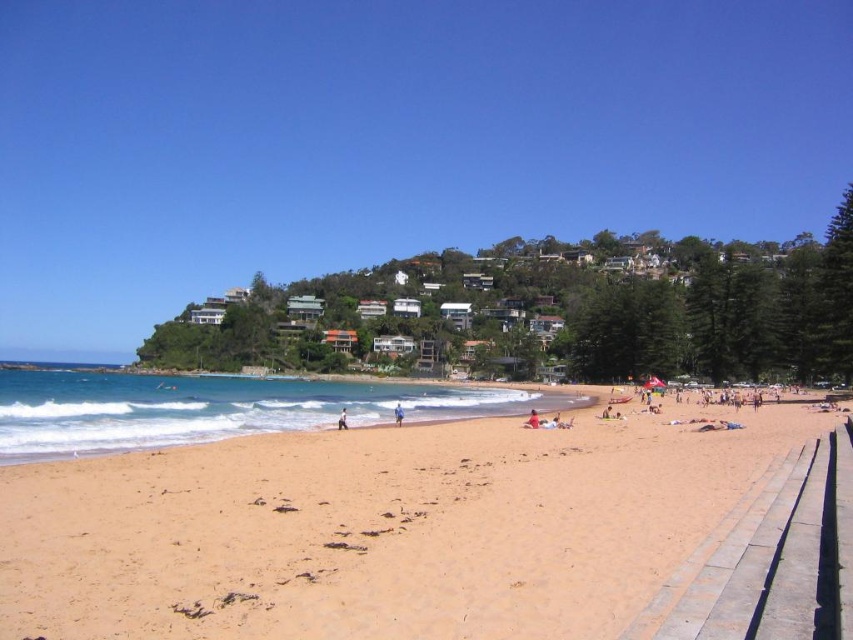
You are a photographer trying to capture a shot of the white fabric person at center and the green grass at upper center. Which object should you focus on first if you want to include both in your frame without moving the camera?

The green grass at upper center is wider than the white fabric person at center, so you should focus on the green grass at upper center first to ensure it fits within the frame.

You are standing on the sandy beach at lower left and looking towards the red fabric person at center. Which object is lower in height?

The sandy beach at lower left has a lesser height compared to the red fabric person at center, so the sandy beach at lower left is lower in height.